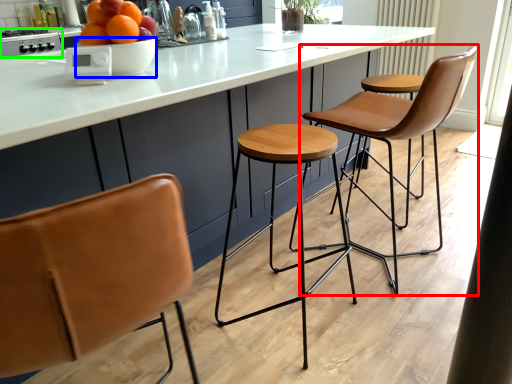
Question: Estimate the real-world distances between objects in this image. Which object is farther from chair (highlighted by a red box), bowl (highlighted by a blue box) or appliance (highlighted by a green box)?

Choices:
 (A) bowl
 (B) appliance

Answer: (B)